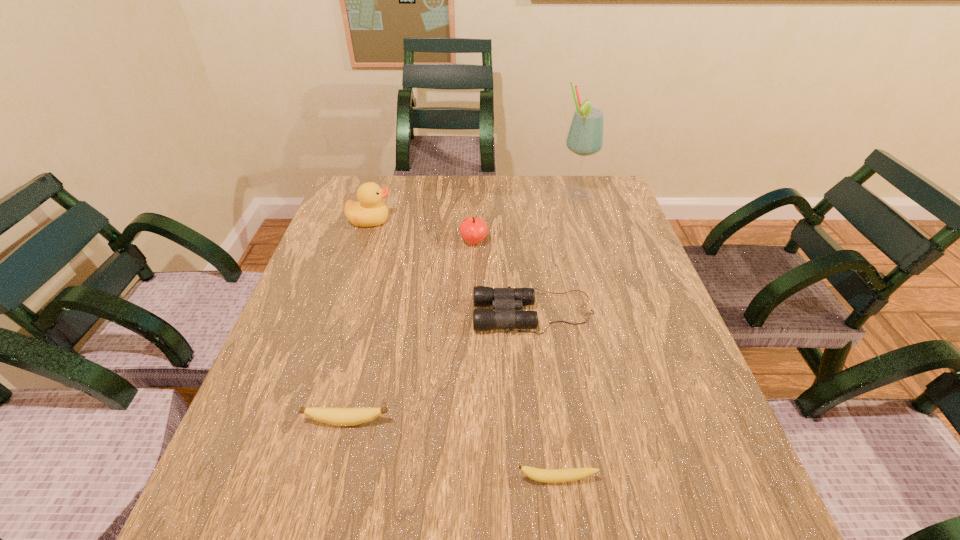
The width and height of the screenshot is (960, 540). I want to click on the tallest object, so click(x=585, y=137).

At what (x,y) coordinates should I click in order to perform the action: click on the farthest object. Please return your answer as a coordinate pair (x, y). This screenshot has height=540, width=960. Looking at the image, I should click on (585, 137).

Locate an element on the screen. duck is located at coordinates (369, 211).

This screenshot has height=540, width=960. I want to click on the fifth nearest object, so click(x=369, y=211).

The height and width of the screenshot is (540, 960). Identify the location of apple. (473, 229).

Where is `the third tallest object`? This screenshot has height=540, width=960. the third tallest object is located at coordinates (473, 229).

The height and width of the screenshot is (540, 960). In order to click on the third shortest object in this screenshot , I will do `click(504, 301)`.

This screenshot has height=540, width=960. In order to click on the fourth farthest object in this screenshot , I will do `click(504, 301)`.

Find the location of a particular element. the farther banana is located at coordinates (335, 416).

Locate an element on the screen. The width and height of the screenshot is (960, 540). the left banana is located at coordinates (335, 416).